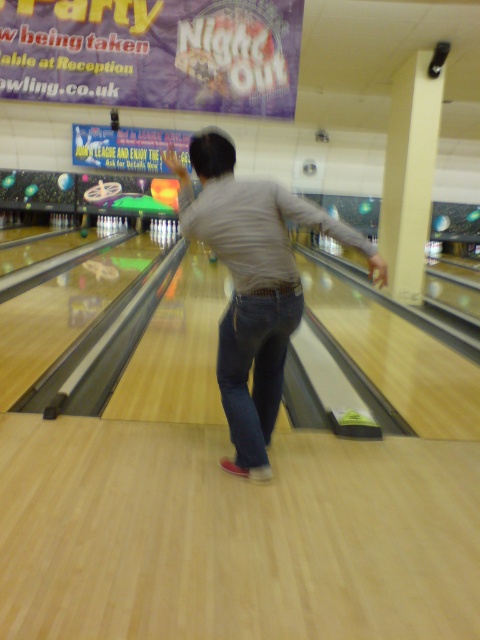
You are standing at the bowling alley and want to know which of the two points, point (237,282) or point (263,371), is closer to you. Based on the scene, can you determine this?

Point (237,282) is closer to the camera than point (263,371), so it is closer to you.